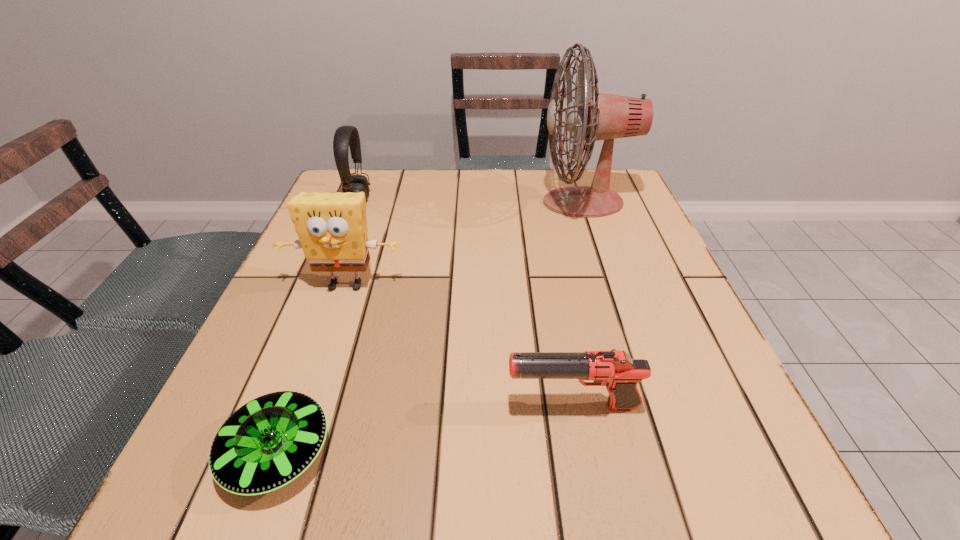
Locate an element on the screen. vacant space located at the aiming end of the fourth tallest object is located at coordinates (306, 406).

Locate an element on the screen. The width and height of the screenshot is (960, 540). vacant position located 0.090m at the aiming end of the fourth tallest object is located at coordinates (450, 406).

Locate an element on the screen. The height and width of the screenshot is (540, 960). vacant area situated 0.150m at the aiming end of the fourth tallest object is located at coordinates (413, 406).

You are a GUI agent. You are given a task and a screenshot of the screen. Output one action in this format:
    pyautogui.click(x=<x>, y=<y>)
    Task: Click on the vacant space positioned on the right of the saucer
    
    Given the screenshot: What is the action you would take?
    pyautogui.click(x=571, y=453)

Identify the location of fan that is at the far edge. (594, 116).

Identify the location of headset that is at the far edge. The height and width of the screenshot is (540, 960). (345, 136).

Identify the location of object that is at the near edge. [270, 441].

Find the location of `sponge located at the left edge`. sponge located at the left edge is located at coordinates (332, 228).

This screenshot has width=960, height=540. I want to click on headset present at the left edge, so click(x=345, y=136).

The width and height of the screenshot is (960, 540). Identify the location of saucer that is at the left edge. (270, 441).